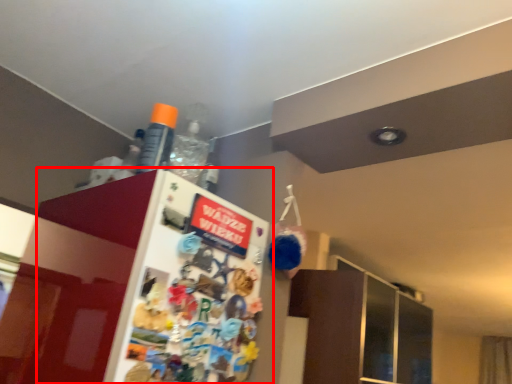
Question: From the image's perspective, where is fridge (annotated by the red box) located relative to bottle?

Choices:
 (A) above
 (B) below

Answer: (B)